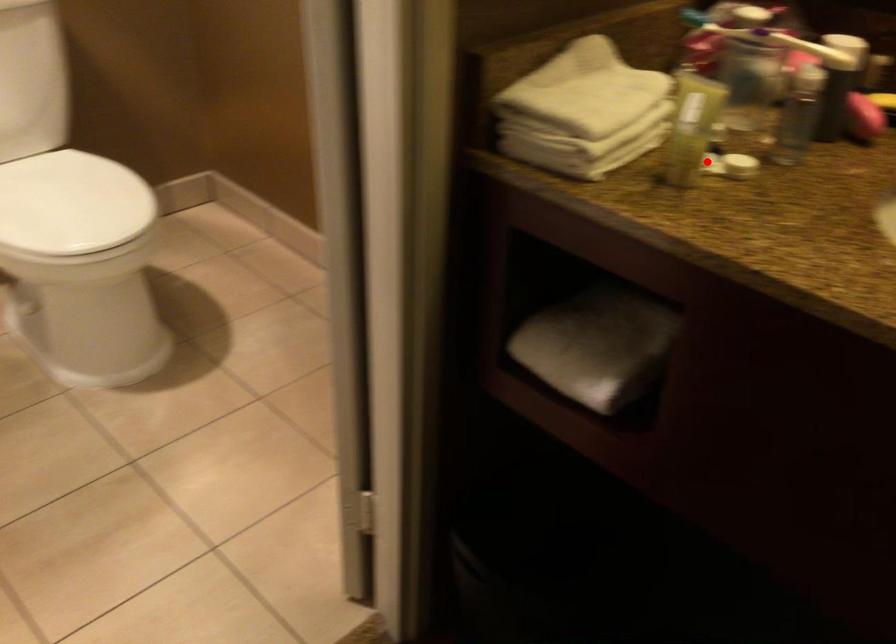
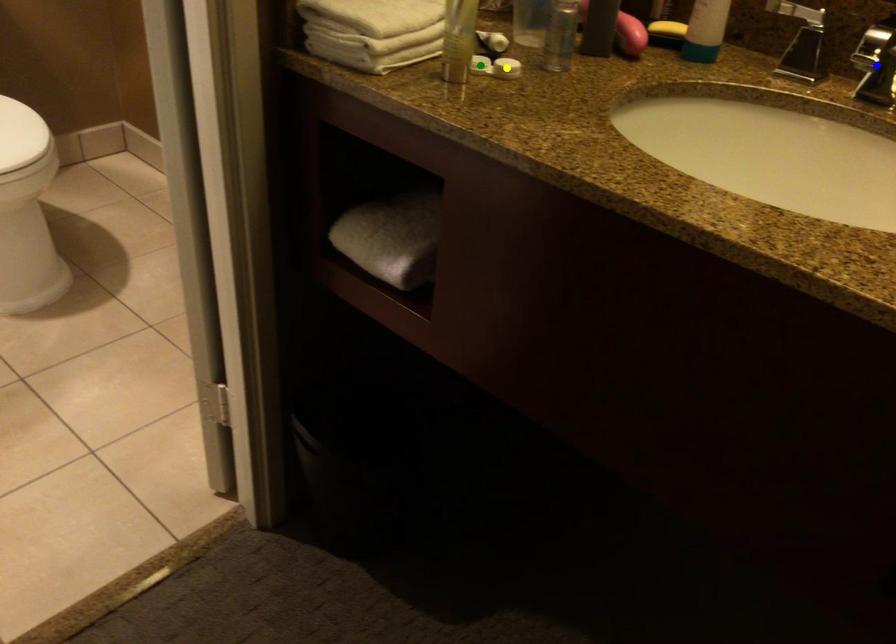
Question: I am providing you with two images of the same scene from different viewpoints. A red point is marked on the first image. You are given multiple points on the second image. Which point in image 2 represents the same 3d spot as the red point in image 1?

Choices:
 (A) blue point
 (B) green point
 (C) yellow point

Answer: (B)